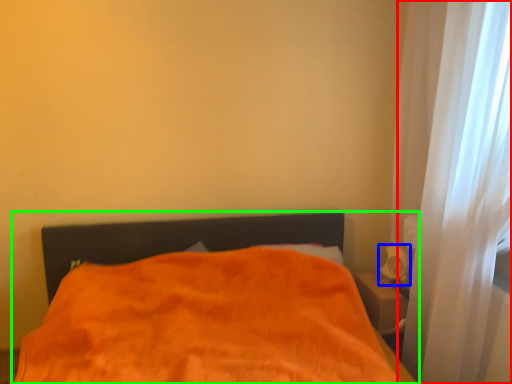
Question: Based on their relative distances, which object is nearer to curtain (highlighted by a red box)? Choose from table lamp (highlighted by a blue box) and bed (highlighted by a green box).

Choices:
 (A) table lamp
 (B) bed

Answer: (A)